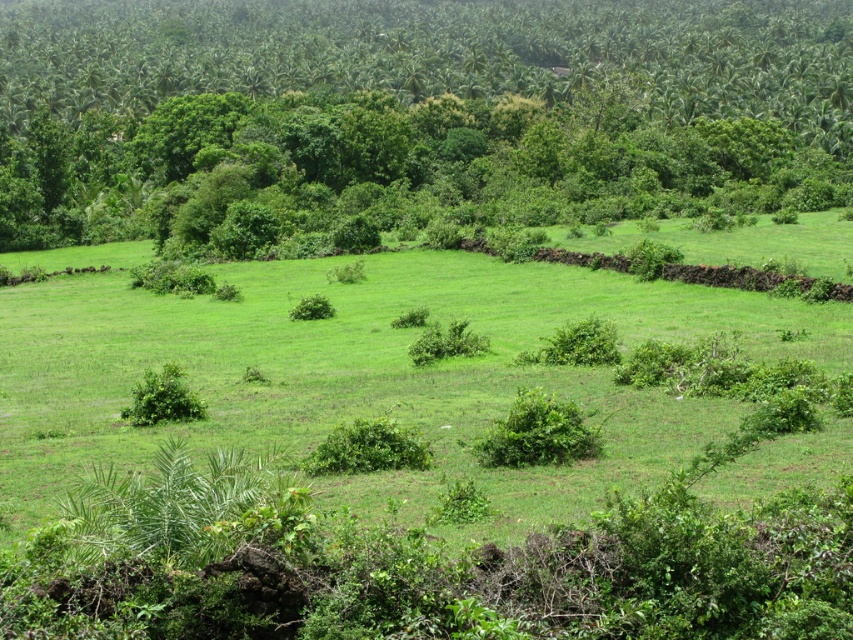
Based on the photo, you are a gardener who needs to mow the lawn. You see the green grass at center and the green leafy tree at upper center. Which one can you mow?

You can mow the green grass at center because it is shorter than the green leafy tree at upper center, making it suitable for mowing.

You are navigating through the landscape and need to determine the order of two points based on their position. Which point is closer to you, point at coordinate (488,355) or point at coordinate (4,29)?

Point at coordinate (488,355) is in front of point at coordinate (4,29), so it is closer to you.